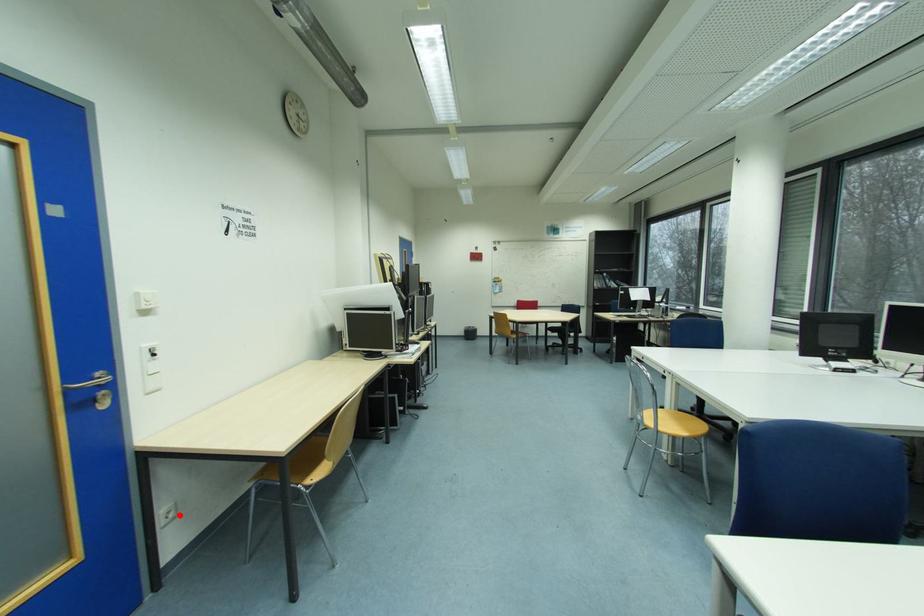
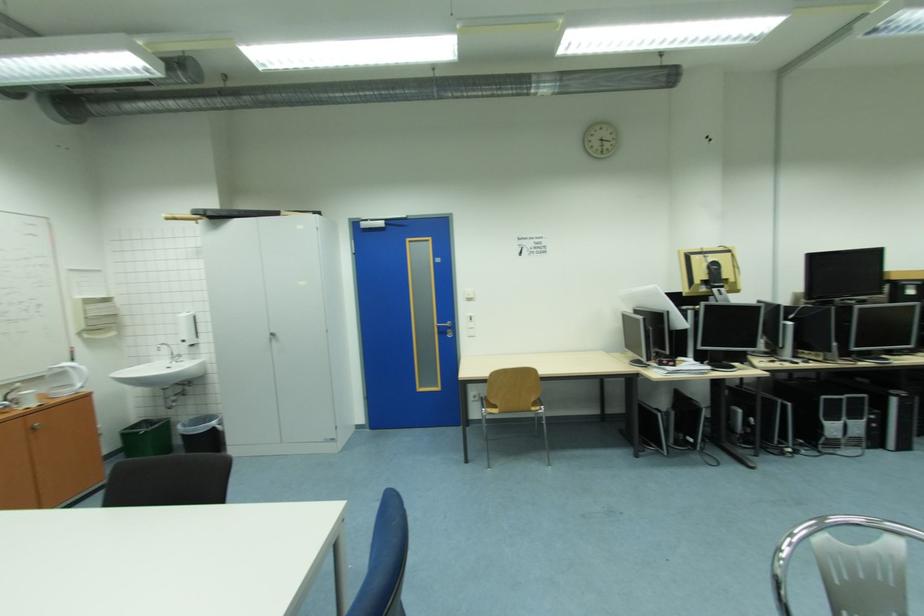
Question: I am providing you with two images of the same scene from different viewpoints. Image1 has a red point marked. In image2, the corresponding 3D location appears at what relative position? Reply with the corresponding letter.

Choices:
 (A) Closer
 (B) Farther

Answer: (B)